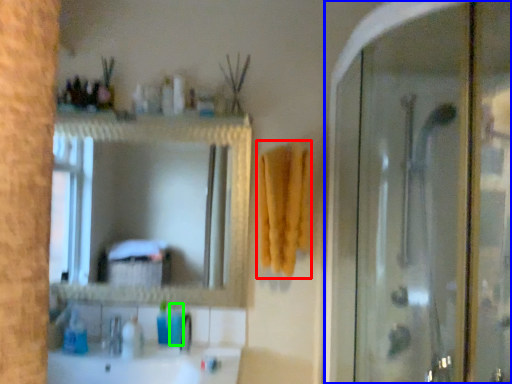
Question: Based on their relative distances, which object is nearer to bath towel (highlighted by a red box)? Choose from screen door (highlighted by a blue box) and toiletry (highlighted by a green box).

Choices:
 (A) screen door
 (B) toiletry

Answer: (A)